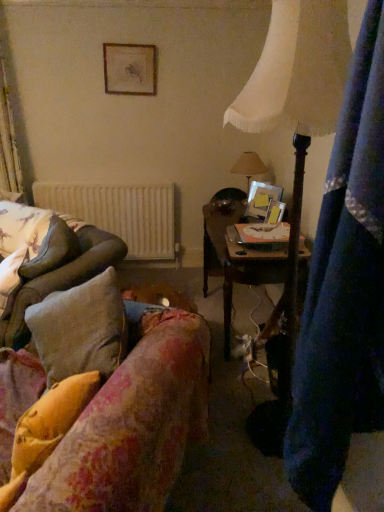
Question: Is fluffy beige pillow at left, the second pillow when ordered from front to back, outside white fabric lampshade at upper right?

Choices:
 (A) yes
 (B) no

Answer: (A)

Question: Is fluffy beige pillow at left, which is counted as the second pillow, starting from the right, aimed at white fabric lampshade at upper right?

Choices:
 (A) no
 (B) yes

Answer: (A)

Question: Is fluffy beige pillow at left, which is counted as the second pillow, starting from the right, touching white fabric lampshade at upper right?

Choices:
 (A) yes
 (B) no

Answer: (B)

Question: From the image's perspective, is fluffy beige pillow at left, arranged as the first pillow when viewed from the back, located beneath white fabric lampshade at upper right?

Choices:
 (A) yes
 (B) no

Answer: (B)

Question: Is the depth of fluffy beige pillow at left, which is the first pillow from top to bottom, greater than that of white fabric lampshade at upper right?

Choices:
 (A) no
 (B) yes

Answer: (B)

Question: Can you confirm if fluffy beige pillow at left, the 2th pillow positioned from the bottom, is taller than white fabric lampshade at upper right?

Choices:
 (A) yes
 (B) no

Answer: (B)

Question: Does metallic silver picture frame at upper right, the 2th picture frame from the front, have a lesser width compared to wooden desk at center?

Choices:
 (A) no
 (B) yes

Answer: (B)

Question: Does metallic silver picture frame at upper right, the 2th picture frame from the front, have a smaller size compared to wooden desk at center?

Choices:
 (A) yes
 (B) no

Answer: (A)

Question: Can you confirm if metallic silver picture frame at upper right, positioned as the second picture frame in back-to-front order, is shorter than wooden desk at center?

Choices:
 (A) yes
 (B) no

Answer: (A)

Question: Considering the relative sizes of metallic silver picture frame at upper right, positioned as the second picture frame in back-to-front order, and wooden desk at center in the image provided, is metallic silver picture frame at upper right, positioned as the second picture frame in back-to-front order, wider than wooden desk at center?

Choices:
 (A) yes
 (B) no

Answer: (B)

Question: From the image's perspective, does metallic silver picture frame at upper right, acting as the 2th picture frame starting from the bottom, appear higher than wooden desk at center?

Choices:
 (A) yes
 (B) no

Answer: (A)

Question: Are metallic silver picture frame at upper right, which appears as the 2th picture frame when viewed from the right, and wooden desk at center far apart?

Choices:
 (A) yes
 (B) no

Answer: (B)

Question: Is white fabric lampshade at upper right at the back of wooden desk at center?

Choices:
 (A) no
 (B) yes

Answer: (A)